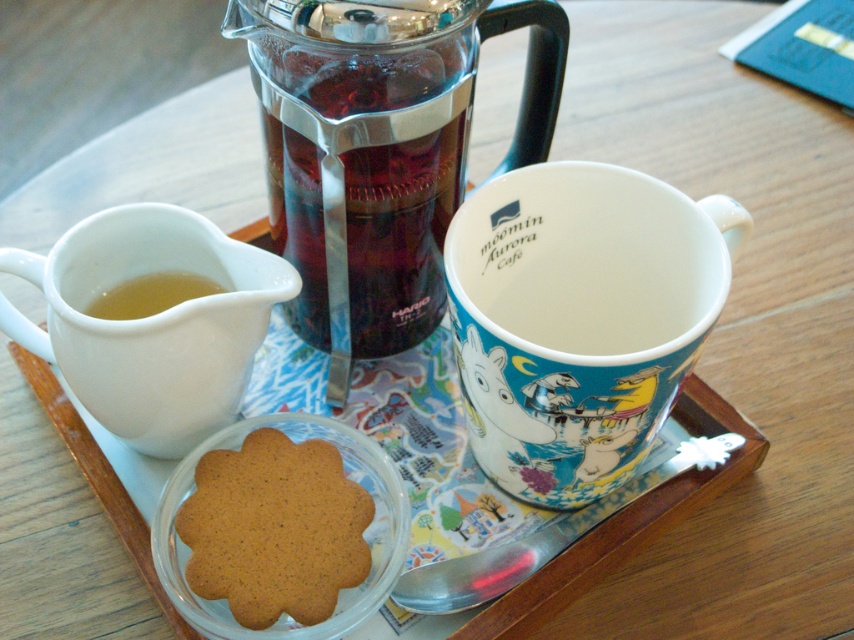
You are a customer at the Aurora Cafe and want to grab the transparent glass tea pot at center to pour tea. However, there is a brown crumbly cookie at center in the way. Based on their positions, can you reach the tea pot without moving the cookie?

The transparent glass tea pot at center is positioned on the right side of brown crumbly cookie at center, so you can reach the tea pot by moving around to the right side of the cookie without disturbing it.

You are a barista trying to place a new item on the tray. The new item is 12 inches wide. Can you fit it between the white ceramic mug at upper right and the translucent glass cup at lower left without overlapping them?

The distance between the white ceramic mug at upper right and the translucent glass cup at lower left is 14.33 inches. Since the new item is 12 inches wide, it can fit between them as the space is wider than the item.